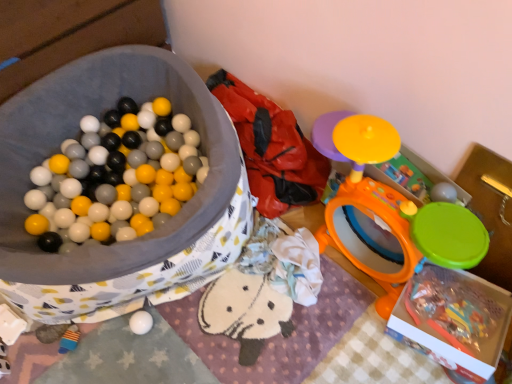
This screenshot has width=512, height=384. In order to click on blank space to the left of smooth plastic toy at lower left, placed as the 1th toy when sorted from left to right in this screenshot , I will do `click(25, 354)`.